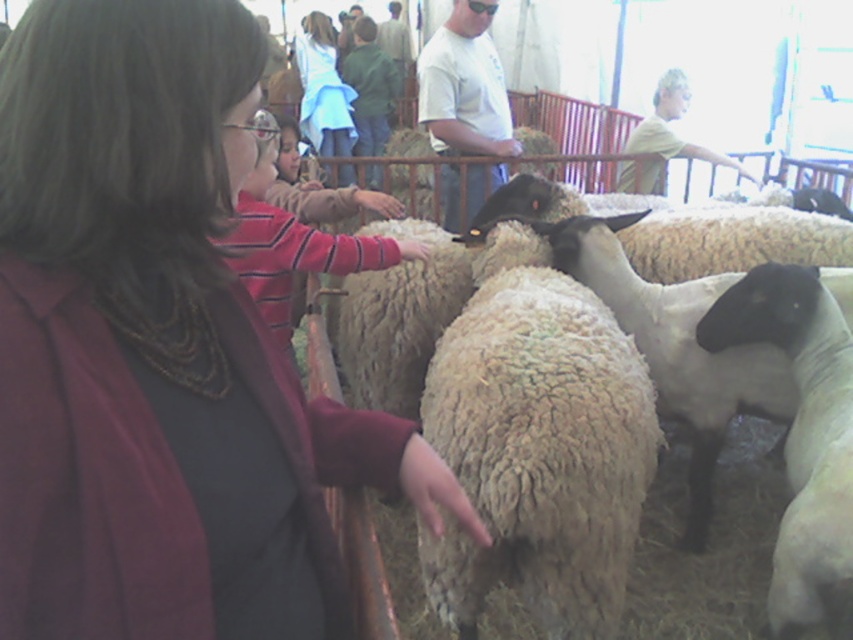
You are a photographer standing at the edge of the fenced area. You want to take a photo of the white woolen sheep at center and the light blue denim jacket at upper center. Which object should you focus on first if you want to capture both in sharp focus?

The white woolen sheep at center is shorter than the light blue denim jacket at upper center. To capture both in sharp focus, you should focus on the light blue denim jacket at upper center first since it is farther away and has a greater depth of field requirement.

You are a photographer at the livestock event. You want to capture a photo where the dark brown hair at center and the white woolen sheep at center are both visible. Which subject should you focus on first if you want to ensure both are in frame?

You should focus on the white woolen sheep at center first since it is wider than the dark brown hair at center, allowing more space for the narrower subject.

You are a photographer at the livestock event. You want to capture a photo that includes both the dark brown hair at center and the light blue denim jacket at upper center. Which object should you focus on first to ensure both are in the frame?

Since the dark brown hair at center occupies less space than the light blue denim jacket at upper center, you should focus on the dark brown hair at center first to ensure it is fully captured in the frame.